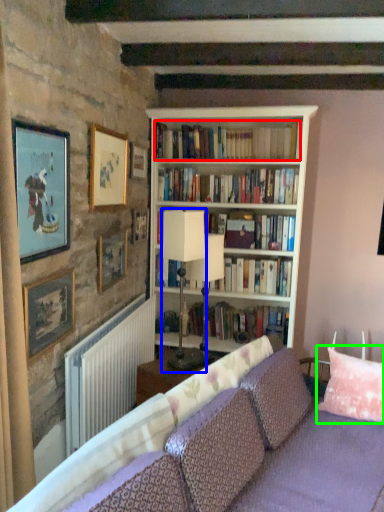
Question: Which is farther away from book (highlighted by a red box)? table lamp (highlighted by a blue box) or pillow (highlighted by a green box)?

Choices:
 (A) table lamp
 (B) pillow

Answer: (B)